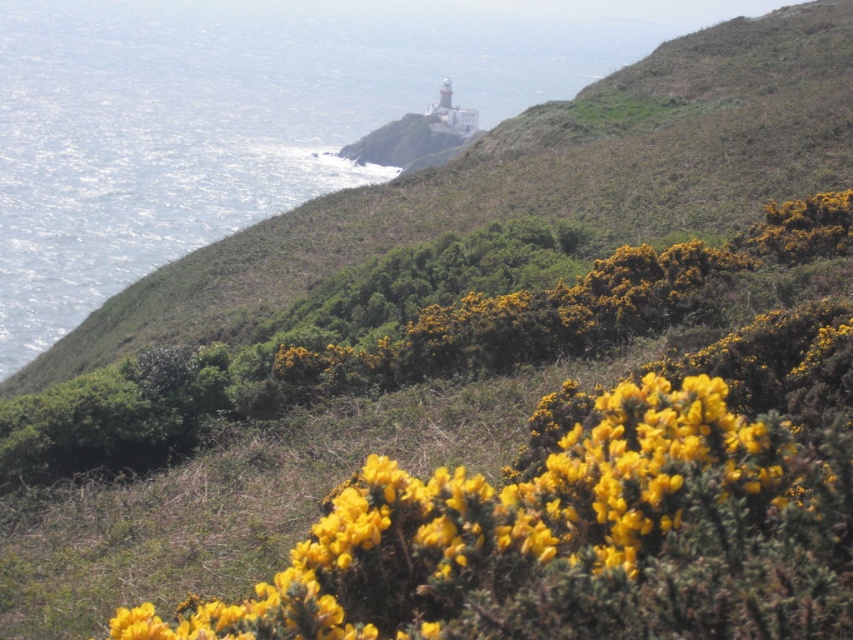
Can you confirm if clear blue water at upper left is thinner than yellow fuzzy bush at lower center?

No, clear blue water at upper left is not thinner than yellow fuzzy bush at lower center.

Can you confirm if clear blue water at upper left is positioned below yellow fuzzy bush at lower center?

No.

Does point (444, 76) come farther from viewer compared to point (598, 506)?

Yes.

You are a GUI agent. You are given a task and a screenshot of the screen. Output one action in this format:
    pyautogui.click(x=<x>, y=<y>)
    Task: Click on the clear blue water at upper left
    The image size is (853, 640).
    Given the screenshot: What is the action you would take?
    pyautogui.click(x=244, y=116)